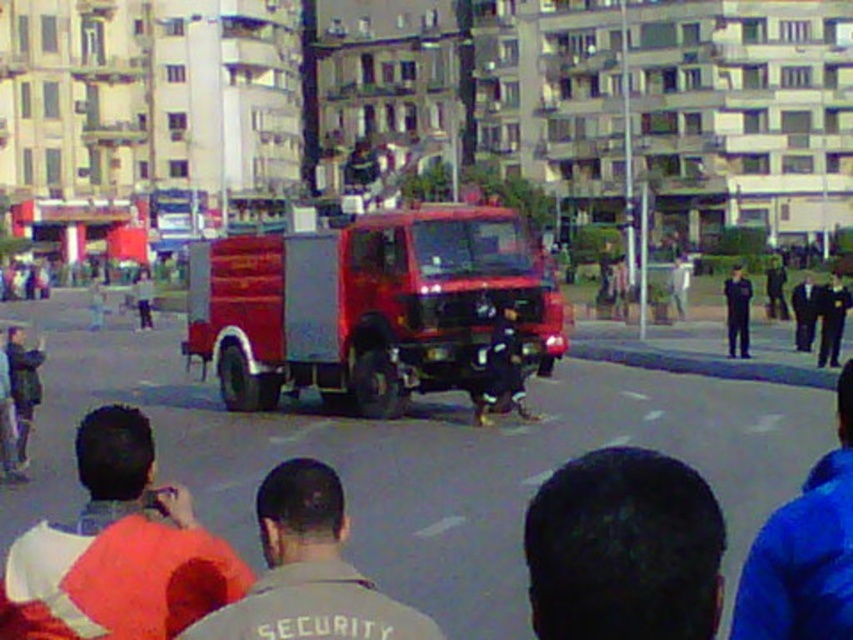
Is the position of gray fabric security guard at center more distant than that of blue fabric jacket at lower right?

Yes, gray fabric security guard at center is behind blue fabric jacket at lower right.

Is point (300, 476) positioned after point (776, 554)?

Yes, it is.

Does point (310, 557) come behind point (764, 592)?

No.

You are a GUI agent. You are given a task and a screenshot of the screen. Output one action in this format:
    pyautogui.click(x=<x>, y=<y>)
    Task: Click on the gray fabric security guard at center
    The width and height of the screenshot is (853, 640).
    Given the screenshot: What is the action you would take?
    pyautogui.click(x=308, y=572)

In the scene shown: Is orange fabric shirt at lower left closer to the viewer compared to blue fabric jacket at lower right?

No, it is behind blue fabric jacket at lower right.

Is orange fabric shirt at lower left to the left of blue fabric jacket at lower right from the viewer's perspective?

Indeed, orange fabric shirt at lower left is positioned on the left side of blue fabric jacket at lower right.

At what (x,y) coordinates should I click in order to perform the action: click on orange fabric shirt at lower left. Please return your answer as a coordinate pair (x, y). Image resolution: width=853 pixels, height=640 pixels. Looking at the image, I should click on (117, 548).

This screenshot has width=853, height=640. I want to click on blue fabric jacket at lower right, so click(x=805, y=552).

Is the position of blue fabric jacket at lower right more distant than that of dark blue uniform at center?

No, blue fabric jacket at lower right is in front of dark blue uniform at center.

I want to click on blue fabric jacket at lower right, so click(x=805, y=552).